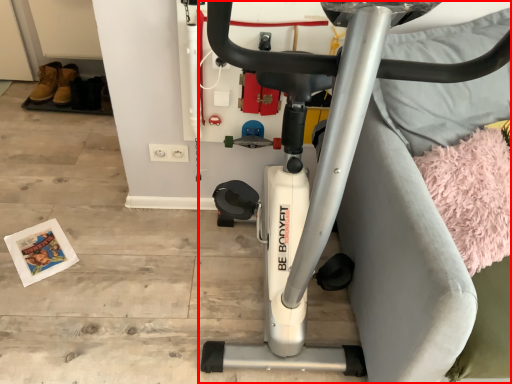
Question: From the image's perspective, where is stationary bicycle (annotated by the red box) located in relation to yoga mat in the image?

Choices:
 (A) below
 (B) above

Answer: (B)